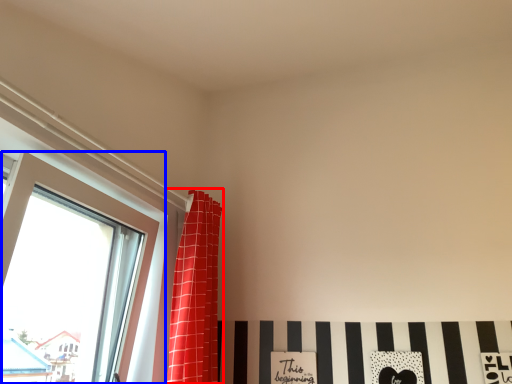
Question: Which of the following is the closest to the observer, curtain (highlighted by a red box) or window (highlighted by a blue box)?

Choices:
 (A) curtain
 (B) window

Answer: (B)